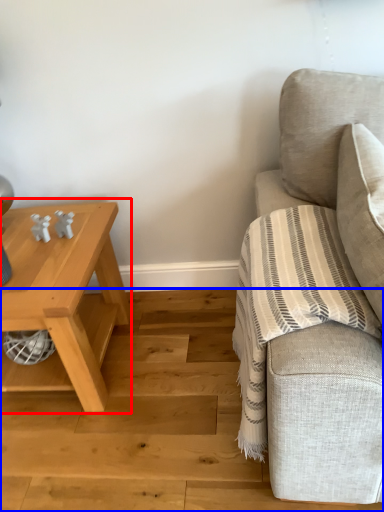
Question: Which point is closer to the camera, table (highlighted by a red box) or stair (highlighted by a blue box)?

Choices:
 (A) table
 (B) stair

Answer: (B)